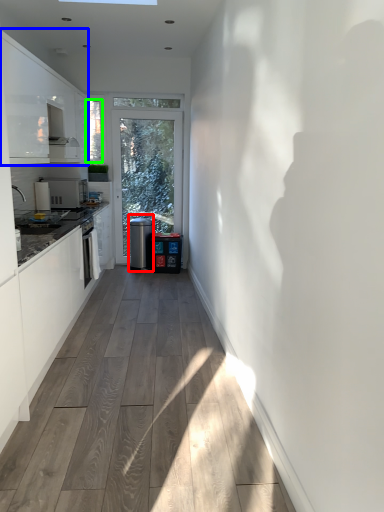
Question: Estimate the real-world distances between objects in this image. Which object is closer to water cooler (highlighted by a red box), cabinetry (highlighted by a blue box) or window screen (highlighted by a green box)?

Choices:
 (A) cabinetry
 (B) window screen

Answer: (B)